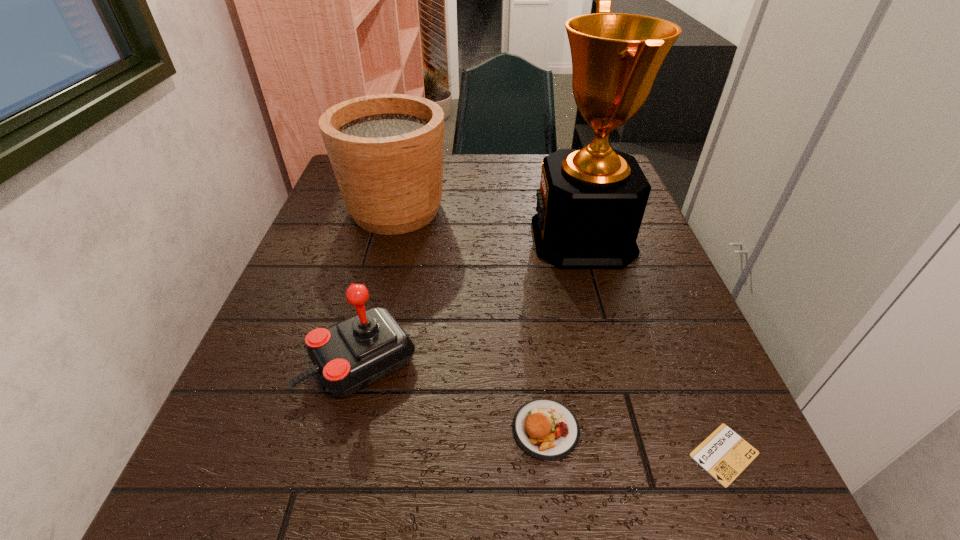
In order to click on the tallest object in this screenshot , I will do `click(591, 202)`.

This screenshot has width=960, height=540. I want to click on flowerpot, so click(386, 150).

This screenshot has width=960, height=540. I want to click on joystick, so click(350, 355).

At what (x,y) coordinates should I click in order to perform the action: click on the fourth tallest object. Please return your answer as a coordinate pair (x, y). Looking at the image, I should click on point(546,429).

Locate an element on the screen. This screenshot has height=540, width=960. the shortest object is located at coordinates (724, 454).

Identify the location of vacant space situated 0.160m on the front of the tallest object with the label. (464, 238).

Locate an element on the screen. This screenshot has height=540, width=960. free space located on the front of the tallest object with the label is located at coordinates (508, 238).

Image resolution: width=960 pixels, height=540 pixels. What are the coordinates of `vacant space located on the front of the tallest object with the label` in the screenshot? It's located at (446, 238).

Image resolution: width=960 pixels, height=540 pixels. I want to click on blank space located on the front of the flowerpot, so click(350, 389).

Where is `vacant space situated on the front of the third tallest object`? The image size is (960, 540). vacant space situated on the front of the third tallest object is located at coordinates (344, 435).